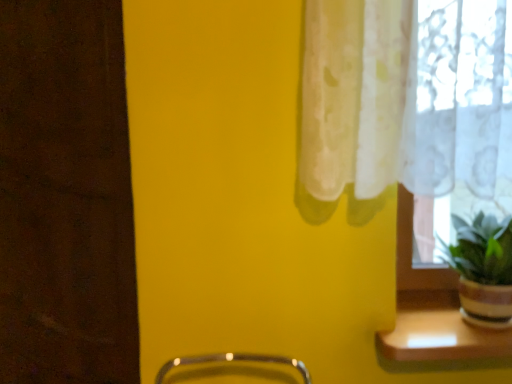
I want to click on vacant region below green matte plant at right (from a real-world perspective), so pyautogui.click(x=466, y=325).